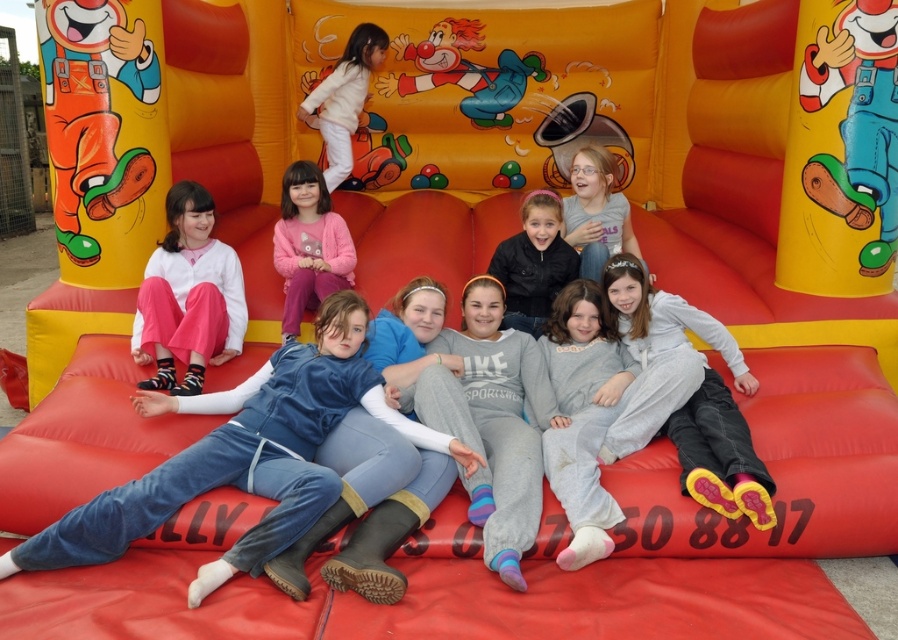
You are standing in front of the bouncy castle and want to know which of the two points, point (188, 340) or point (591, 145), is closer to you. Based on the scene description, which point is nearer?

Point (188, 340) is closer to the camera than point (591, 145), so it is the nearer one.

You are a photographer trying to capture a clear shot of both the matte pink pants at lower left and the matte pink sweater at center. Since you want to ensure both are in focus, which object should you adjust your camera focus on first considering their sizes?

The matte pink pants at lower left might be wider than the matte pink sweater at center, so you should focus on the wider object first to ensure both are in focus.

You are a photographer standing to the right of the bouncy castle. You want to take a photo that includes both the blue denim pants at lower left and the matte pink sweater at center. Based on their positions, which object should you adjust your camera angle to focus on first to ensure both are in frame?

The blue denim pants at lower left is positioned on the left side of matte pink sweater at center. To include both in the frame, you should first focus on the blue denim pants at lower left since it is further to the left and adjust the camera angle to include the matte pink sweater at center on the right.